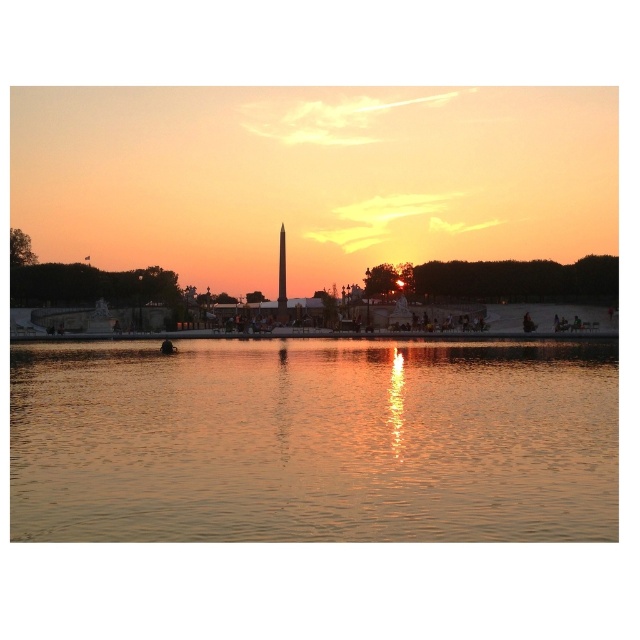
You are standing at the edge of the reflecting pool in the park, and you see a point marked at coordinates point (602, 500). If you want to reach that point without entering the water, what is the minimum distance you need to walk along the pool edge?

The point (602, 500) is 24.34 meters away from you, so you need to walk at least 24.34 meters along the pool edge to reach it.

You are standing at the edge of the reflecting pool in the park and see two points in the scene. The first point is at coordinates point (x=342, y=536) and the second is at point (x=284, y=316). Which point is closer to your current position?

Point (x=342, y=536) is closer to the camera than point (x=284, y=316), so the first point is closer to your current position.

Looking at this image, you are a photographer wanting to capture the golden reflective water at center and the polished stone obelisk at center in a single shot. Given that your camera can only focus on one object at a time, which object should you prioritize focusing on to ensure its details are clear, considering their sizes?

The golden reflective water at center is larger in size than the polished stone obelisk at center, so focusing on the larger golden reflective water at center would ensure its details are clearer in the photo.